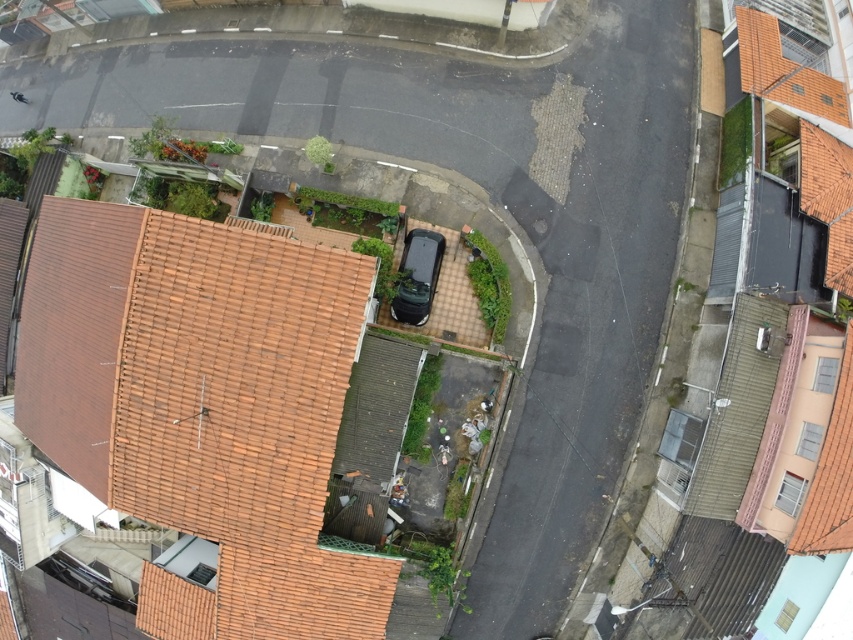
Question: Observing the image, what is the correct spatial positioning of brown tile roof at lower left in reference to orange tile roof at upper right?

Choices:
 (A) left
 (B) right

Answer: (A)

Question: Is the position of brown tile roof at lower left less distant than that of orange tile roof at upper right?

Choices:
 (A) yes
 (B) no

Answer: (A)

Question: Which point appears farthest from the camera in this image?

Choices:
 (A) (756, 28)
 (B) (202, 323)

Answer: (A)

Question: Is brown tile roof at lower left to the right of orange tile roof at upper right from the viewer's perspective?

Choices:
 (A) no
 (B) yes

Answer: (A)

Question: Which point is farther to the camera?

Choices:
 (A) orange tile roof at upper right
 (B) brown tile roof at lower left

Answer: (A)